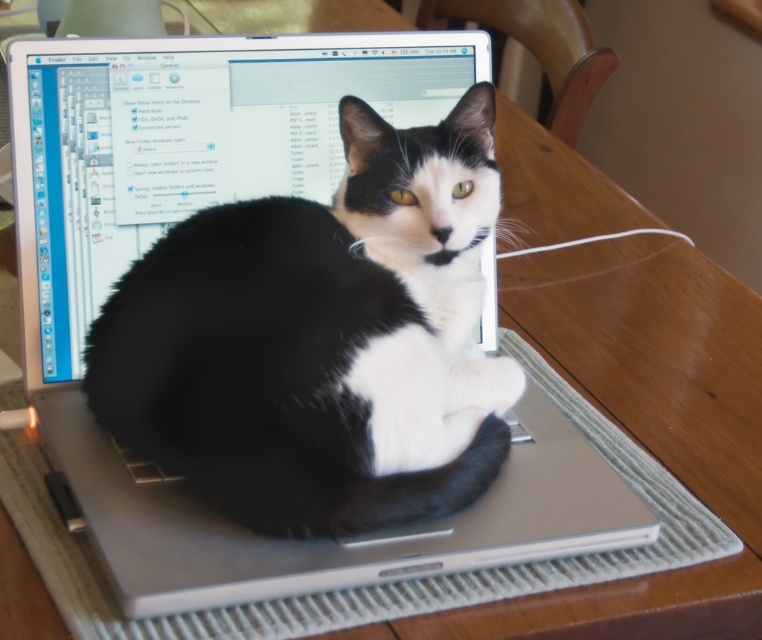
Does black fur cat at center have a lesser width compared to white string at upper right?

In fact, black fur cat at center might be wider than white string at upper right.

Is point (167, 280) behind point (613, 232)?

No, (167, 280) is closer to viewer.

Identify the location of black fur cat at center. The image size is (762, 640). (322, 339).